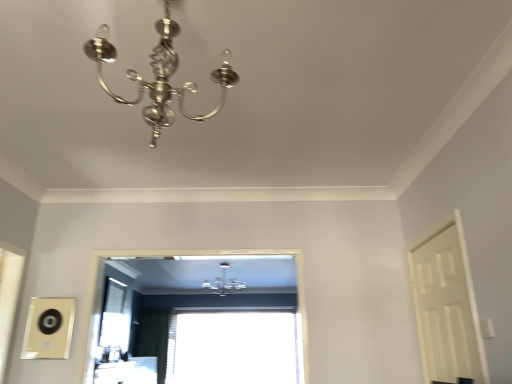
Question: Is polished silver chandelier at upper center, which ranks as the first lamp in front-to-back order, facing towards transparent glass window at center, the 1th window from the bottom?

Choices:
 (A) yes
 (B) no

Answer: (A)

Question: Is polished silver chandelier at upper center, marked as the second lamp in a back-to-front arrangement, positioned beyond the bounds of transparent glass window at center, arranged as the 2th window when viewed from the top?

Choices:
 (A) yes
 (B) no

Answer: (A)

Question: From the image's perspective, is polished silver chandelier at upper center, the 1th lamp in the top-to-bottom sequence, above transparent glass window at center, positioned as the second window in front-to-back order?

Choices:
 (A) yes
 (B) no

Answer: (A)

Question: Can you confirm if polished silver chandelier at upper center, arranged as the 2th lamp when ordered from the bottom, is positioned to the right of transparent glass window at center, which ranks as the first window in back-to-front order?

Choices:
 (A) no
 (B) yes

Answer: (B)

Question: From a real-world perspective, is polished silver chandelier at upper center, the 1th lamp in the top-to-bottom sequence, over transparent glass window at center, which ranks as the first window in back-to-front order?

Choices:
 (A) no
 (B) yes

Answer: (B)

Question: Is polished silver chandelier at upper center, arranged as the 2th lamp when ordered from the bottom, inside the boundaries of satin silver chandelier at upper center, marked as the second lamp in a top-to-bottom arrangement, or outside?

Choices:
 (A) outside
 (B) inside

Answer: (A)

Question: Looking at the image, does polished silver chandelier at upper center, which ranks as the first lamp in front-to-back order, seem bigger or smaller compared to satin silver chandelier at upper center, marked as the second lamp in a top-to-bottom arrangement?

Choices:
 (A) big
 (B) small

Answer: (B)

Question: From the image's perspective, is polished silver chandelier at upper center, the 1th lamp in the top-to-bottom sequence, above or below satin silver chandelier at upper center, which is the 2th lamp in front-to-back order?

Choices:
 (A) above
 (B) below

Answer: (A)

Question: Relative to satin silver chandelier at upper center, placed as the 1th lamp when sorted from back to front, is polished silver chandelier at upper center, the 1th lamp in the top-to-bottom sequence, in front or behind?

Choices:
 (A) front
 (B) behind

Answer: (A)

Question: From a real-world perspective, is transparent glass window at center, arranged as the 2th window when viewed from the top, positioned above or below white matte door at right?

Choices:
 (A) above
 (B) below

Answer: (B)

Question: Is transparent glass window at center, which ranks as the first window in back-to-front order, taller or shorter than white matte door at right?

Choices:
 (A) tall
 (B) short

Answer: (A)

Question: Would you say transparent glass window at center, arranged as the 2th window when viewed from the top, is to the left or to the right of white matte door at right in the picture?

Choices:
 (A) right
 (B) left

Answer: (B)

Question: Choose the correct answer: Is transparent glass window at center, positioned as the second window in front-to-back order, inside white matte door at right or outside it?

Choices:
 (A) outside
 (B) inside

Answer: (A)

Question: From a real-world perspective, relative to transparent glass window at center, acting as the 1th window starting from the top, is polished silver chandelier at upper center, marked as the second lamp in a back-to-front arrangement, vertically above or below?

Choices:
 (A) above
 (B) below

Answer: (A)

Question: Considering the positions of polished silver chandelier at upper center, marked as the second lamp in a back-to-front arrangement, and transparent glass window at center, which appears as the second window when ordered from the bottom, in the image, is polished silver chandelier at upper center, marked as the second lamp in a back-to-front arrangement, wider or thinner than transparent glass window at center, which appears as the second window when ordered from the bottom,?

Choices:
 (A) wide
 (B) thin

Answer: (B)